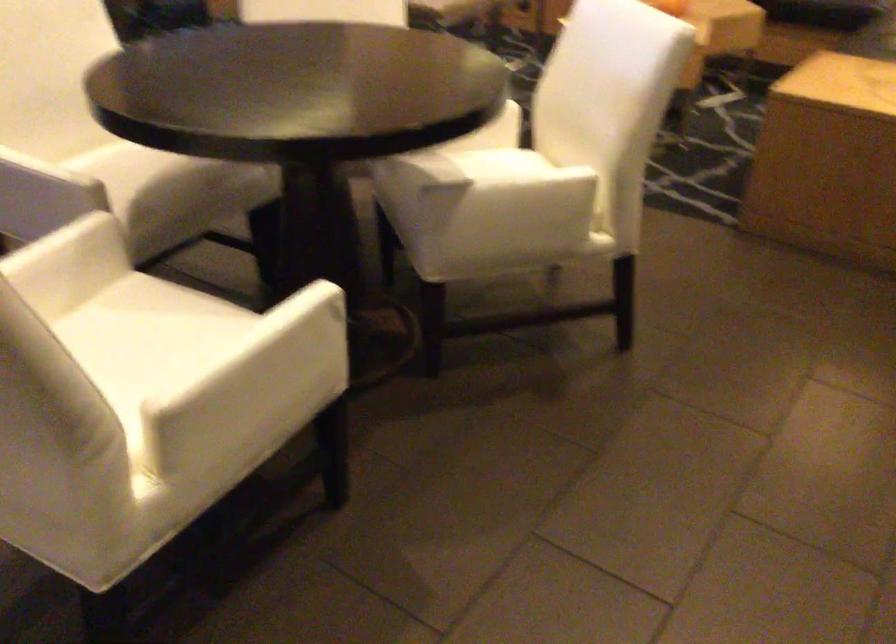
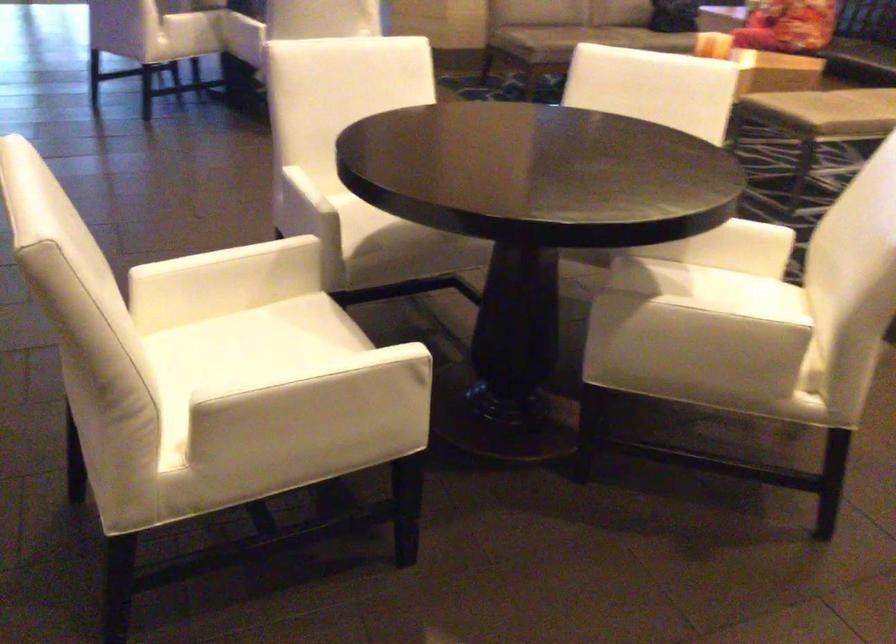
Locate, in the second image, the point that corresponds to point (513, 194) in the first image.

(699, 319)